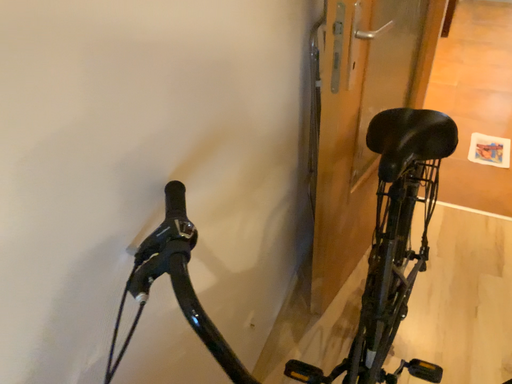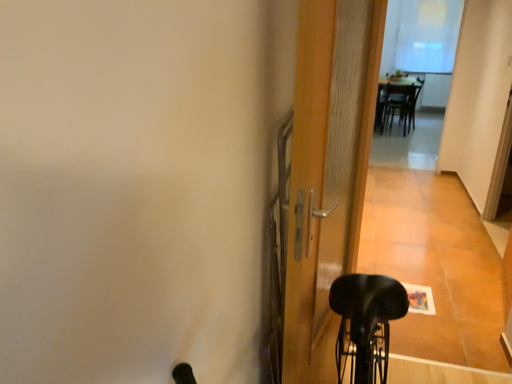
Question: How did the camera likely rotate when shooting the video?

Choices:
 (A) rotated upward
 (B) rotated downward

Answer: (A)